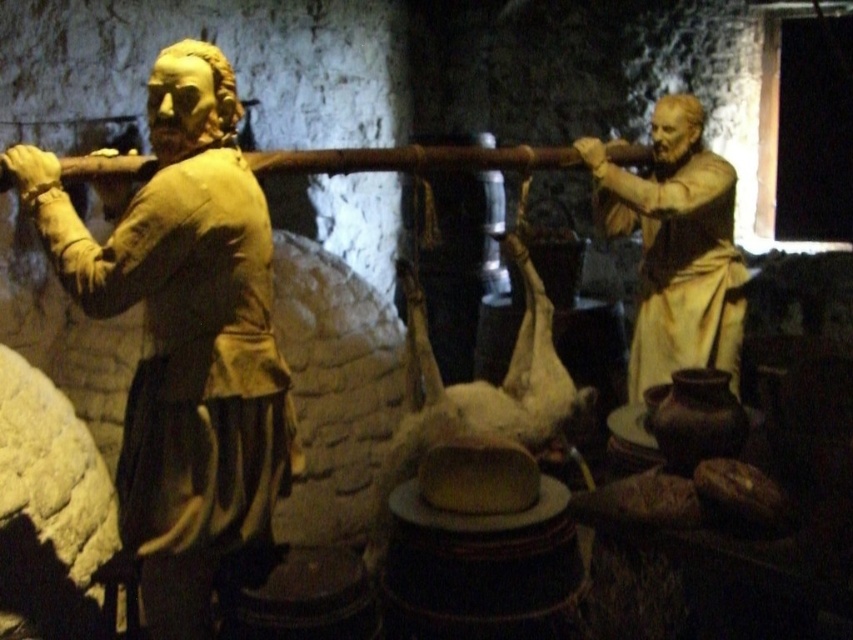
Question: Can you confirm if matte gold statue at left is positioned to the left of matte gold statue at right?

Choices:
 (A) yes
 (B) no

Answer: (A)

Question: Which object is farther from the camera taking this photo?

Choices:
 (A) matte gold statue at right
 (B) matte gold statue at left

Answer: (A)

Question: Is matte gold statue at left smaller than matte gold statue at right?

Choices:
 (A) yes
 (B) no

Answer: (A)

Question: Can you confirm if matte gold statue at left is positioned above matte gold statue at right?

Choices:
 (A) yes
 (B) no

Answer: (B)

Question: Which of the following is the closest to the observer?

Choices:
 (A) matte gold statue at right
 (B) matte gold statue at left

Answer: (B)

Question: Which of the following is the closest to the observer?

Choices:
 (A) (189, 291)
 (B) (579, 152)

Answer: (A)